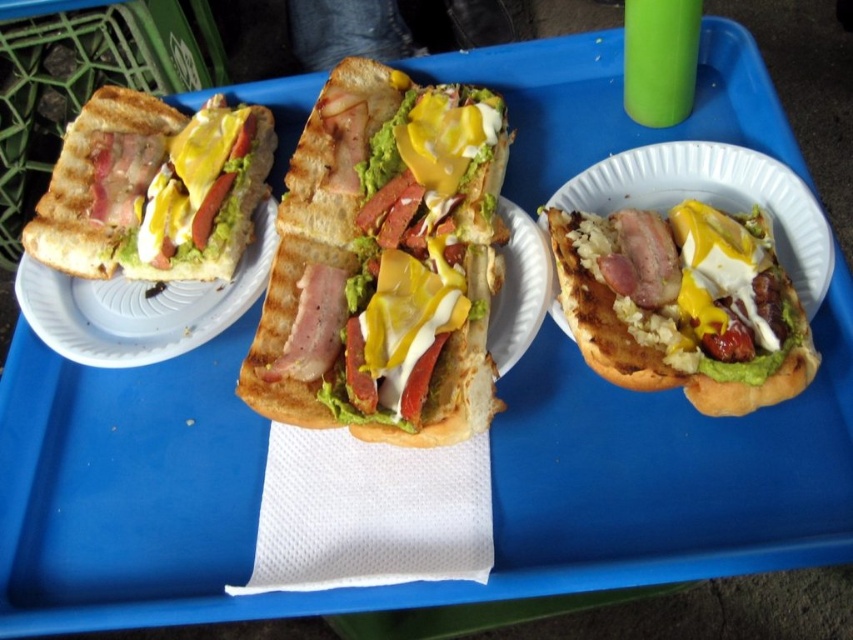
You are a food delivery person who needs to hand over the meal. The customer asks you to describe the spatial arrangement of the two items on the tray. Specifically, where is the matte white bread at right relative to the yellow creamy cheese at center? Please describe their positions without mentioning their types of bread or cheese.

The matte white bread at right is positioned in front of the yellow creamy cheese at center, meaning it is closer to the observer than the yellow creamy cheese at center.

Consider the image. You are a food delivery person who needs to place the matte white bread at right and the yellow creamy cheese at center into a rectangular container. The container can only hold items that are smaller than 15 cm in width. Can both items fit in the container?

The matte white bread at right has a larger size compared to the yellow creamy cheese at center. Since the container can only hold items smaller than 15 cm in width, we need to check the sizes of both items. However, the description only provides a relative size comparison between them, not their exact dimensions. Without knowing the exact width of the matte white bread at right, we cannot confirm if it fits within the 15 cm limit. Therefore, it is uncertain if both items will fit in the container.

In the scene shown: You are a food delivery person holding a 30 inch long ruler. You need to measure the distance between the grilled bread sandwich at center and the camera. Can you do it with your ruler?

The distance between the grilled bread sandwich at center and the camera is 28.23 inches, so yes, the ruler is long enough to measure the distance between the grilled bread sandwich at center and the camera.